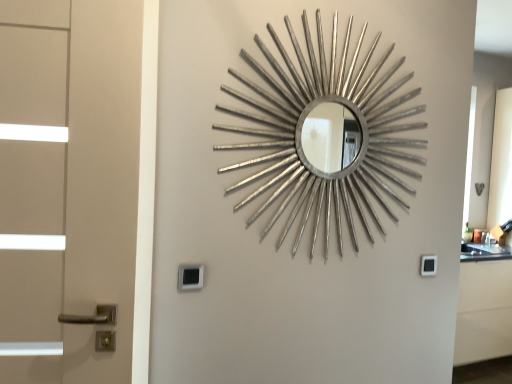
Question: Considering the relative positions of silver metallic mirror at center and black plastic lock at lower center, the second lock in the right-to-left sequence, in the image provided, is silver metallic mirror at center behind black plastic lock at lower center, the second lock in the right-to-left sequence,?

Choices:
 (A) yes
 (B) no

Answer: (B)

Question: Does silver metallic mirror at center lie in front of black plastic lock at lower center, arranged as the first lock when viewed from the front?

Choices:
 (A) no
 (B) yes

Answer: (B)

Question: From the image's perspective, is silver metallic mirror at center on top of black plastic lock at lower center, which appears as the 1th lock when viewed from the left?

Choices:
 (A) no
 (B) yes

Answer: (B)

Question: From a real-world perspective, is silver metallic mirror at center physically above black plastic lock at lower center, the second lock in the right-to-left sequence?

Choices:
 (A) no
 (B) yes

Answer: (B)

Question: Can you confirm if silver metallic mirror at center is positioned to the right of black plastic lock at lower center, arranged as the first lock when viewed from the front?

Choices:
 (A) no
 (B) yes

Answer: (B)

Question: Is silver metallic mirror at center bigger or smaller than black plastic lock at lower right, the 1th lock in the back-to-front sequence?

Choices:
 (A) big
 (B) small

Answer: (A)

Question: From a real-world perspective, is silver metallic mirror at center above or below black plastic lock at lower right, the 2th lock viewed from the front?

Choices:
 (A) below
 (B) above

Answer: (B)

Question: From the image's perspective, relative to black plastic lock at lower right, which is the second lock from left to right, is silver metallic mirror at center above or below?

Choices:
 (A) below
 (B) above

Answer: (B)

Question: Considering the positions of silver metallic mirror at center and black plastic lock at lower right, which is the second lock from left to right, in the image, is silver metallic mirror at center taller or shorter than black plastic lock at lower right, which is the second lock from left to right,?

Choices:
 (A) tall
 (B) short

Answer: (A)

Question: In terms of height, does black plastic lock at lower center, which appears as the 2th lock when viewed from the back, look taller or shorter compared to black plastic lock at lower right, the 1th lock in the back-to-front sequence?

Choices:
 (A) short
 (B) tall

Answer: (B)

Question: Looking at their shapes, would you say black plastic lock at lower center, arranged as the first lock when viewed from the front, is wider or thinner than black plastic lock at lower right, which is counted as the first lock, starting from the right?

Choices:
 (A) wide
 (B) thin

Answer: (A)

Question: Based on their positions, is black plastic lock at lower center, the second lock in the right-to-left sequence, located to the left or right of black plastic lock at lower right, the 2th lock viewed from the front?

Choices:
 (A) right
 (B) left

Answer: (B)

Question: Relative to black plastic lock at lower right, the 1th lock in the back-to-front sequence, is black plastic lock at lower center, the second lock in the right-to-left sequence, in front or behind?

Choices:
 (A) behind
 (B) front

Answer: (B)

Question: From a real-world perspective, is black plastic lock at lower right, which is counted as the first lock, starting from the right, positioned above or below silver metallic mirror at center?

Choices:
 (A) above
 (B) below

Answer: (B)

Question: From the image's perspective, is black plastic lock at lower right, the 1th lock in the back-to-front sequence, positioned above or below silver metallic mirror at center?

Choices:
 (A) above
 (B) below

Answer: (B)